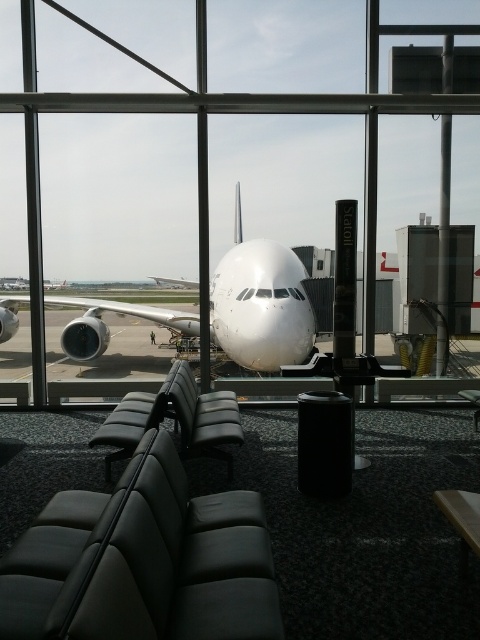
Question: Which point is farther from the camera taking this photo?

Choices:
 (A) (309, 320)
 (B) (197, 568)

Answer: (A)

Question: Can you confirm if black leather chair at lower left is positioned to the right of leather seat at center?

Choices:
 (A) no
 (B) yes

Answer: (B)

Question: Is the position of leather seat at center less distant than that of black leather chair at center?

Choices:
 (A) no
 (B) yes

Answer: (A)

Question: Based on their relative distances, which object is farther from the leather seat at center?

Choices:
 (A) black leather chair at center
 (B) black leather chair at lower left
 (C) white glossy airplane at center

Answer: (C)

Question: Which object appears farthest from the camera in this image?

Choices:
 (A) black leather chair at center
 (B) black leather chair at lower left

Answer: (A)

Question: Does black leather chair at lower left appear on the left side of leather seat at center?

Choices:
 (A) no
 (B) yes

Answer: (A)